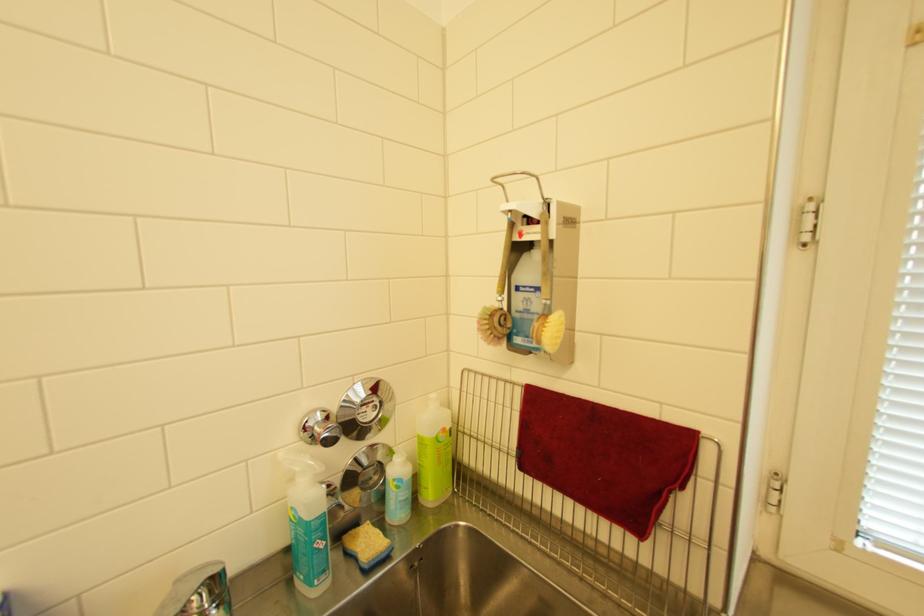
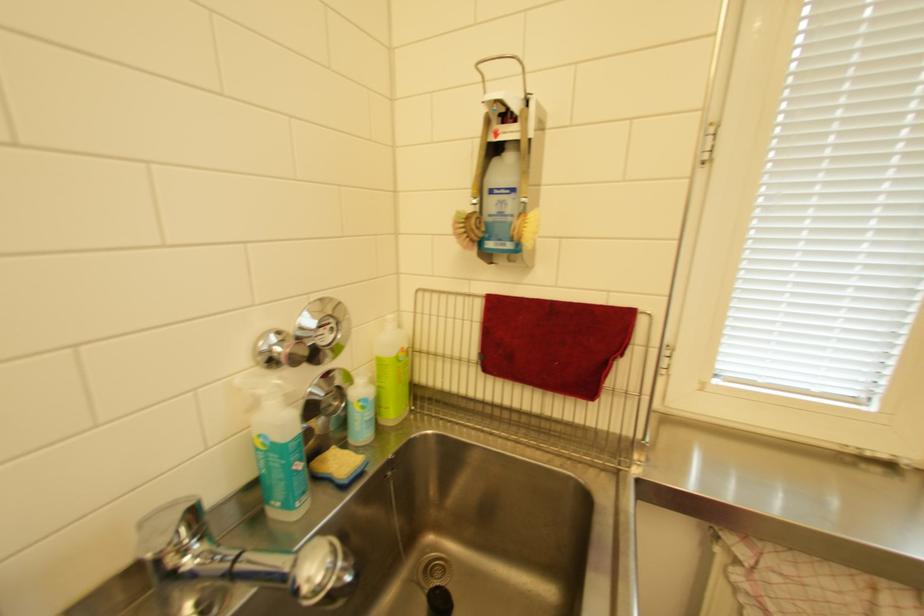
Locate, in the second image, the point that corresponds to point (402, 480) in the first image.

(367, 400)